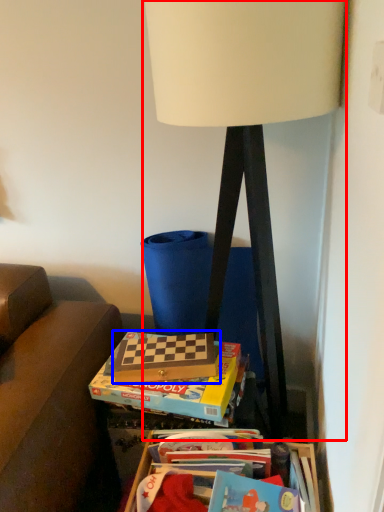
Question: Which object is closer to the camera taking this photo, lamp (highlighted by a red box) or paperback book (highlighted by a blue box)?

Choices:
 (A) lamp
 (B) paperback book

Answer: (A)